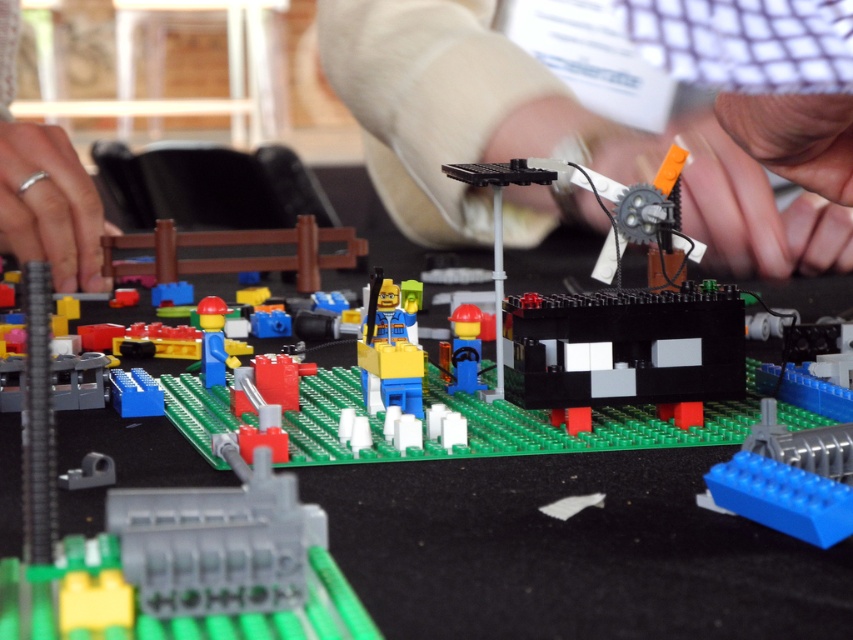
Question: Can you confirm if green plastic table at center is bigger than smooth plastic hand at center?

Choices:
 (A) yes
 (B) no

Answer: (A)

Question: Is silver metallic ring at lower left to the left of brick-like yellow figure at center from the viewer's perspective?

Choices:
 (A) no
 (B) yes

Answer: (B)

Question: Which object is the closest to the gray plastic connector at center?

Choices:
 (A) green plastic table at center
 (B) smooth plastic hand at center
 (C) brick-like yellow figure at center
 (D) silver metallic ring at lower left

Answer: (C)

Question: Which of the following is the farthest from the observer?

Choices:
 (A) (675, 632)
 (B) (265, 563)
 (C) (451, 387)

Answer: (C)

Question: Considering the real-world distances, which object is closest to the brick-like yellow figure at center?

Choices:
 (A) translucent blue plastic figure at center
 (B) green plastic table at center
 (C) gray plastic connector at center
 (D) silver metallic ring at lower left

Answer: (A)

Question: In this image, where is brick-like yellow figure at center located relative to translucent blue plastic figure at center?

Choices:
 (A) right
 (B) left

Answer: (B)